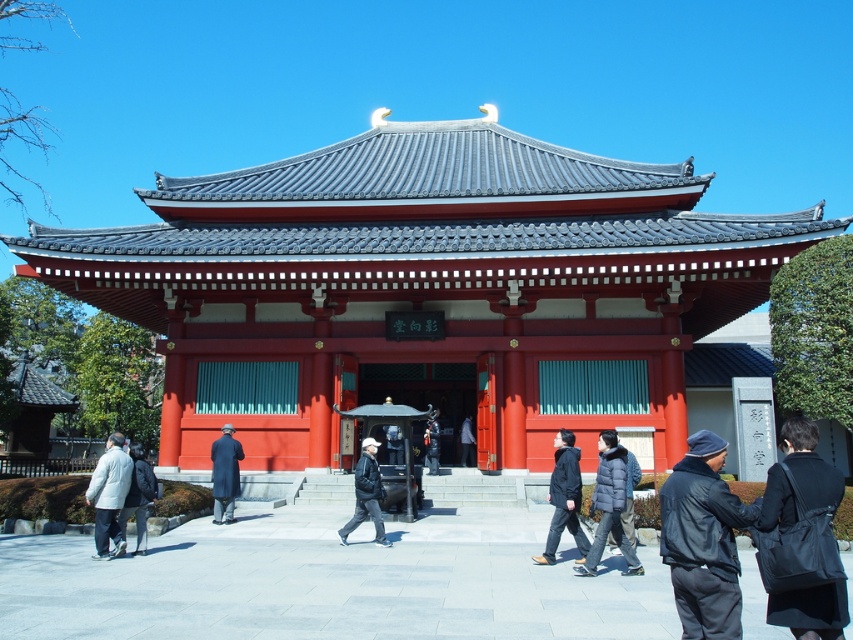
You are a visitor at the temple and want to take a photo of the temple entrance. You notice two jackets hanging on a rack nearby. The dark gray fabric jacket at center and the white cotton jacket at lower left. Which jacket is shorter in height?

The dark gray fabric jacket at center has a lesser height compared to the white cotton jacket at lower left, so the dark gray fabric jacket at center is shorter.

You are standing in front of the traditional Japanese temple and see two points marked on the ground. The first point is at coordinate point (543,560) and the second point is at coordinate point (473,460). Which point is closer to the entrance of the temple?

Point (543,560) is in front of point (473,460), so the first point is closer to the entrance of the temple.